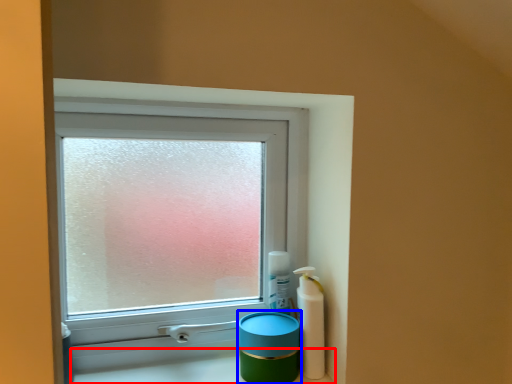
Question: Which object appears closest to the camera in this image, counter top (highlighted by a red box) or teal (highlighted by a blue box)?

Choices:
 (A) counter top
 (B) teal

Answer: (A)